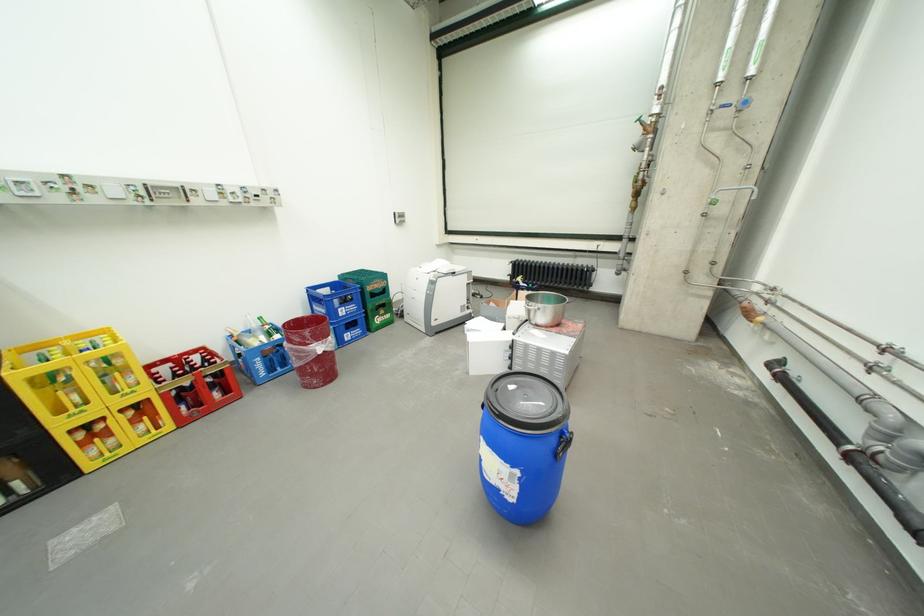
Find the location of a particular element. The height and width of the screenshot is (616, 924). white light switch is located at coordinates (398, 217).